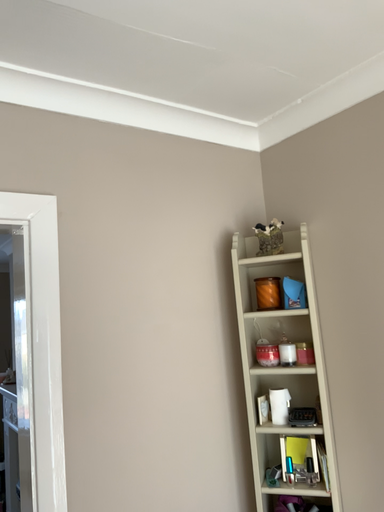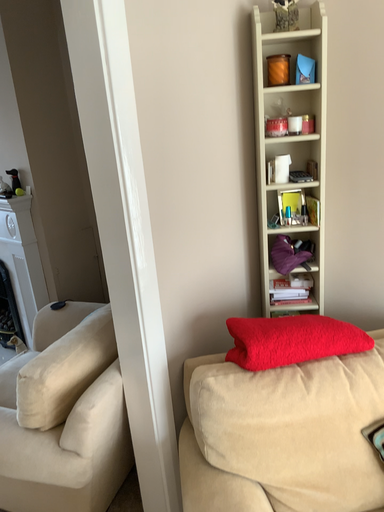
Question: Which way did the camera rotate in the video?

Choices:
 (A) rotated upward
 (B) rotated downward

Answer: (B)